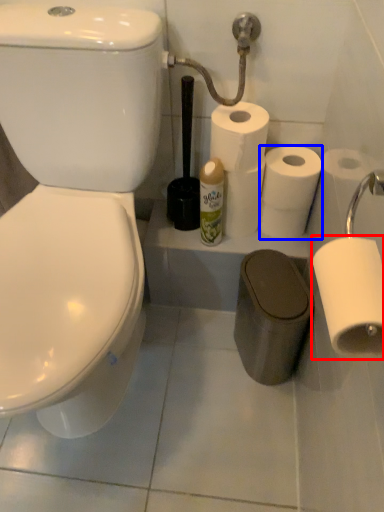
Question: Which object is further to the camera taking this photo, toilet paper (highlighted by a red box) or toilet paper (highlighted by a blue box)?

Choices:
 (A) toilet paper
 (B) toilet paper

Answer: (B)